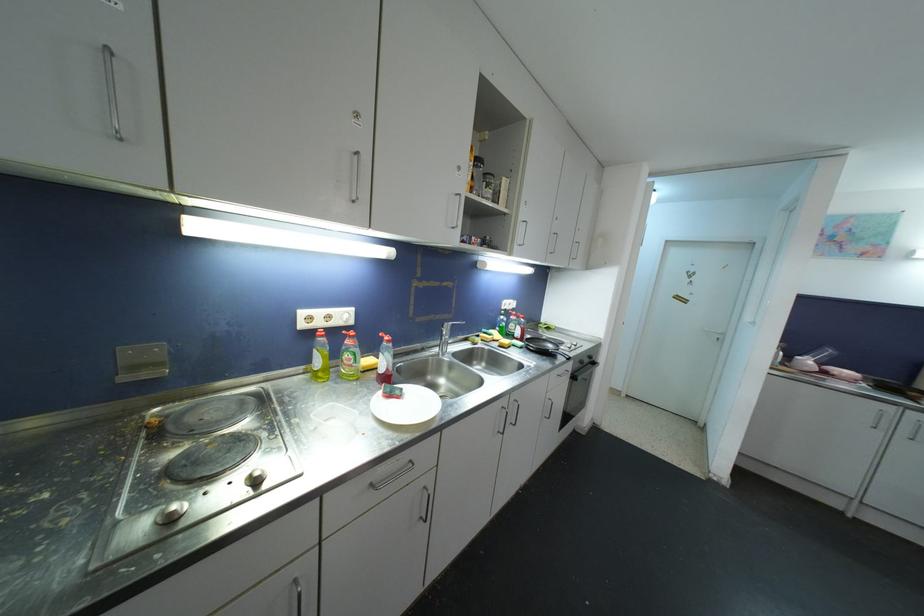
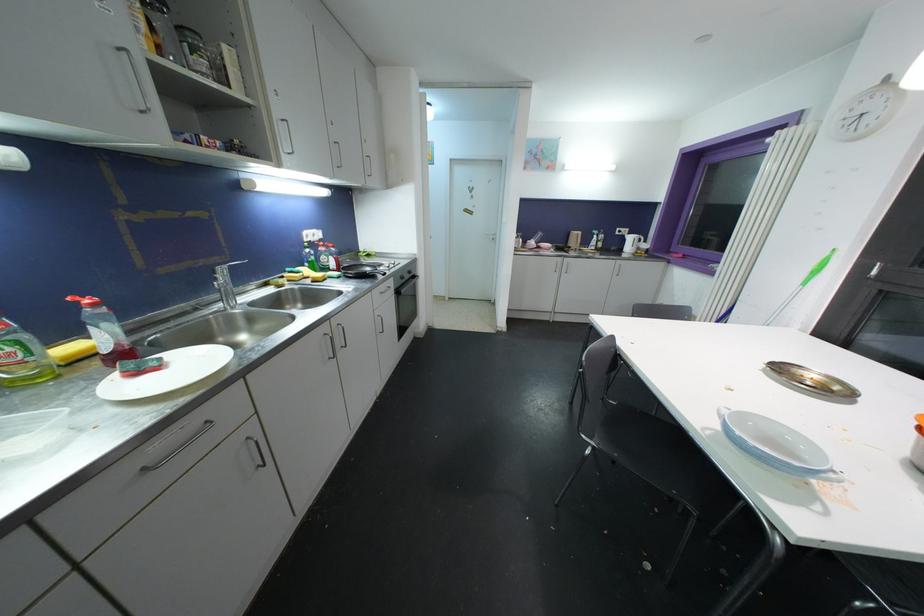
In the second image, find the point that corresponds to (x=414, y=464) in the first image.

(210, 424)